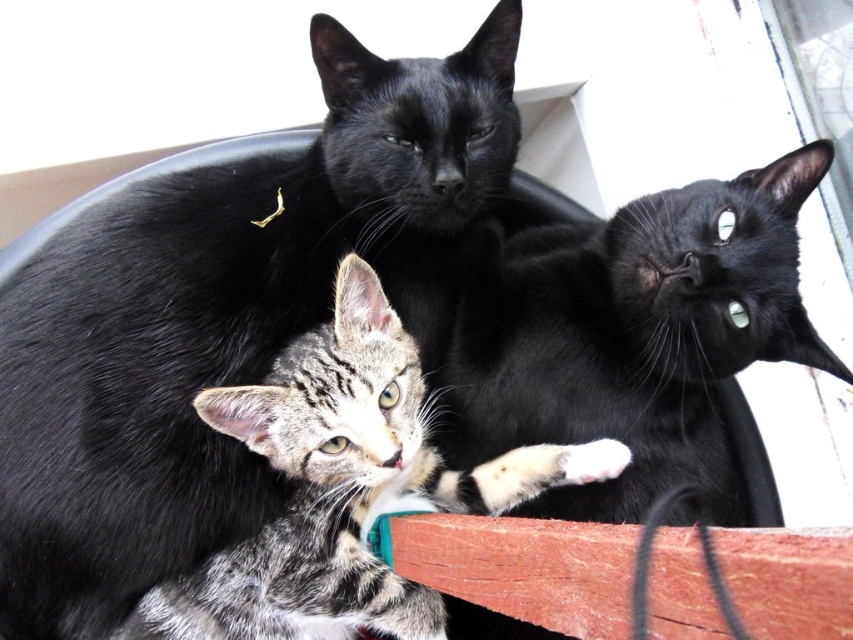
What do you see at coordinates (223, 317) in the screenshot?
I see `shiny black cat at upper center` at bounding box center [223, 317].

Who is more forward, (380, 145) or (537, 282)?

Point (380, 145) is more forward.

Image resolution: width=853 pixels, height=640 pixels. Find the location of `shiny black cat at upper center`. shiny black cat at upper center is located at coordinates (223, 317).